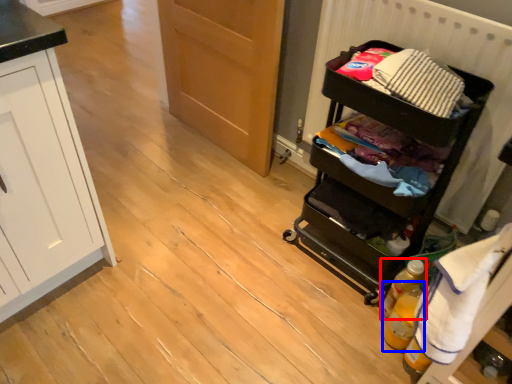
Question: Which point is closer to the camera, bottle (highlighted by a red box) or bottle (highlighted by a blue box)?

Choices:
 (A) bottle
 (B) bottle

Answer: (B)